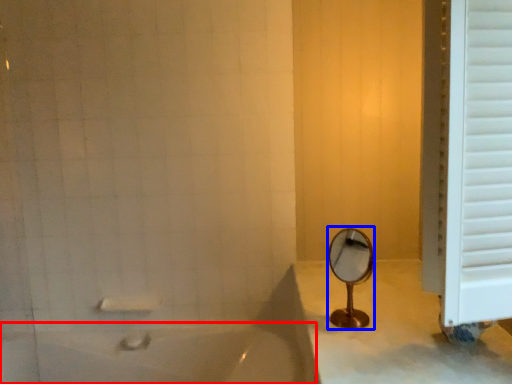
Question: Among these objects, which one is farthest to the camera, bathtub (highlighted by a red box) or mirror (highlighted by a blue box)?

Choices:
 (A) bathtub
 (B) mirror

Answer: (A)